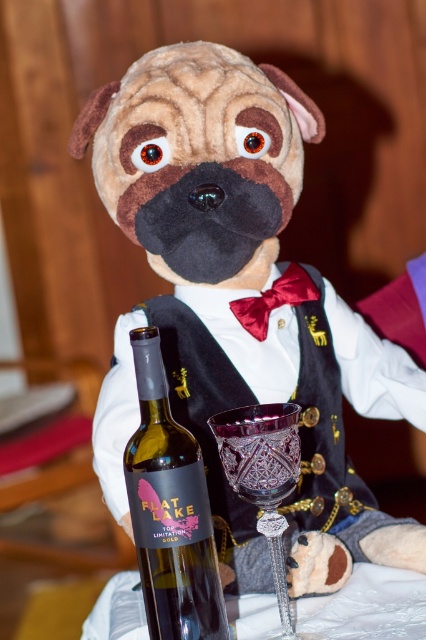
Question: Does brown plush dog at center have a smaller size compared to translucent glass bottle at center?

Choices:
 (A) no
 (B) yes

Answer: (A)

Question: Which point is closer to the camera taking this photo?

Choices:
 (A) (213, 552)
 (B) (267, 506)

Answer: (A)

Question: Does brown plush dog at center have a smaller size compared to translucent glass bottle at center?

Choices:
 (A) no
 (B) yes

Answer: (A)

Question: Which object is farther from the camera taking this photo?

Choices:
 (A) brown plush dog at center
 (B) amber crystal wine glass at center
 (C) translucent glass bottle at center

Answer: (A)

Question: Does brown plush dog at center come behind translucent glass bottle at center?

Choices:
 (A) yes
 (B) no

Answer: (A)

Question: Which of the following is the farthest from the observer?

Choices:
 (A) translucent glass bottle at center
 (B) brown plush dog at center
 (C) amber crystal wine glass at center

Answer: (B)